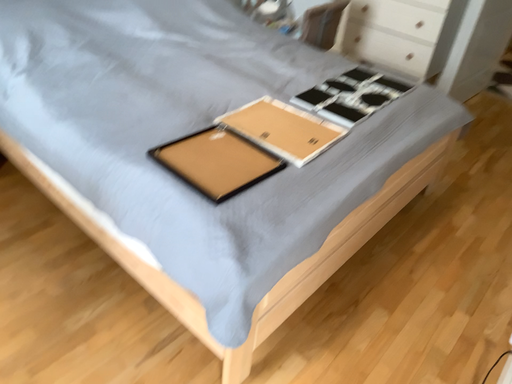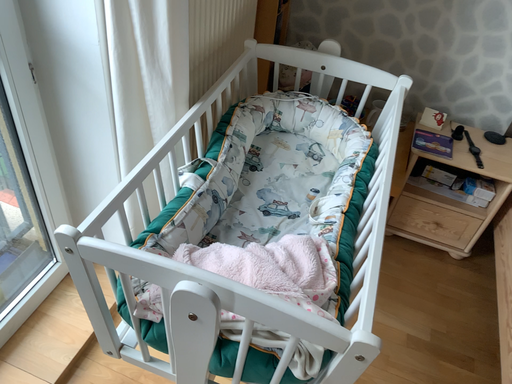
Question: Which way did the camera rotate in the video?

Choices:
 (A) rotated left
 (B) rotated right

Answer: (A)